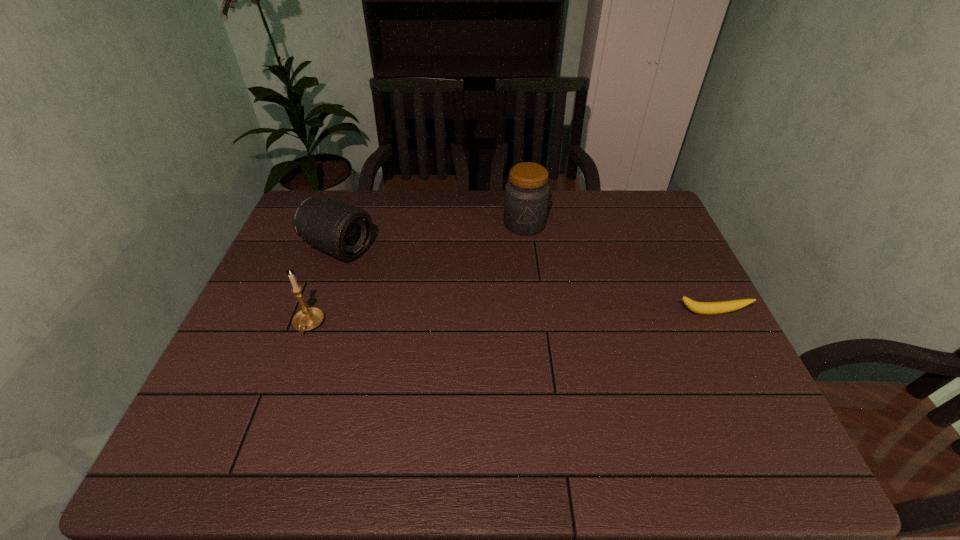
At what (x,y) coordinates should I click in order to perform the action: click on vacant area at the left edge. Please return your answer as a coordinate pair (x, y). The width and height of the screenshot is (960, 540). Looking at the image, I should click on (296, 269).

In the image, there is a desktop. At what (x,y) coordinates should I click in order to perform the action: click on free region at the right edge. Please return your answer as a coordinate pair (x, y). Image resolution: width=960 pixels, height=540 pixels. Looking at the image, I should click on (683, 342).

Image resolution: width=960 pixels, height=540 pixels. In the image, there is a desktop. Identify the location of vacant space at the far right corner. (647, 190).

Locate an element on the screen. This screenshot has width=960, height=540. blank space at the near right corner of the desktop is located at coordinates (715, 418).

At what (x,y) coordinates should I click in order to perform the action: click on empty space that is in between the second object from right to left and the candle holder. Please return your answer as a coordinate pair (x, y). Looking at the image, I should click on click(417, 274).

Locate an element on the screen. free space between the candle holder and the second object from right to left is located at coordinates (417, 274).

At what (x,y) coordinates should I click in order to perform the action: click on free space between the candle holder and the telephoto lens. Please return your answer as a coordinate pair (x, y). This screenshot has width=960, height=540. Looking at the image, I should click on (324, 287).

Find the location of a particular element. free area in between the third tallest object and the candle holder is located at coordinates (324, 287).

Locate an element on the screen. This screenshot has width=960, height=540. vacant space that is in between the jar and the rightmost object is located at coordinates (617, 268).

Locate an element on the screen. The width and height of the screenshot is (960, 540). free space between the candle holder and the banana is located at coordinates (510, 319).